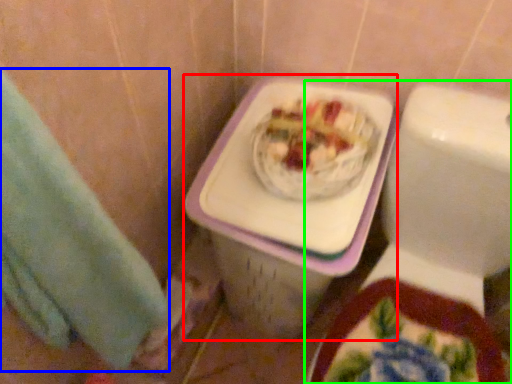
Question: Considering the real-world distances, which object is closest to porcelain (highlighted by a red box)? hand towel (highlighted by a blue box) or toilet (highlighted by a green box).

Choices:
 (A) hand towel
 (B) toilet

Answer: (B)